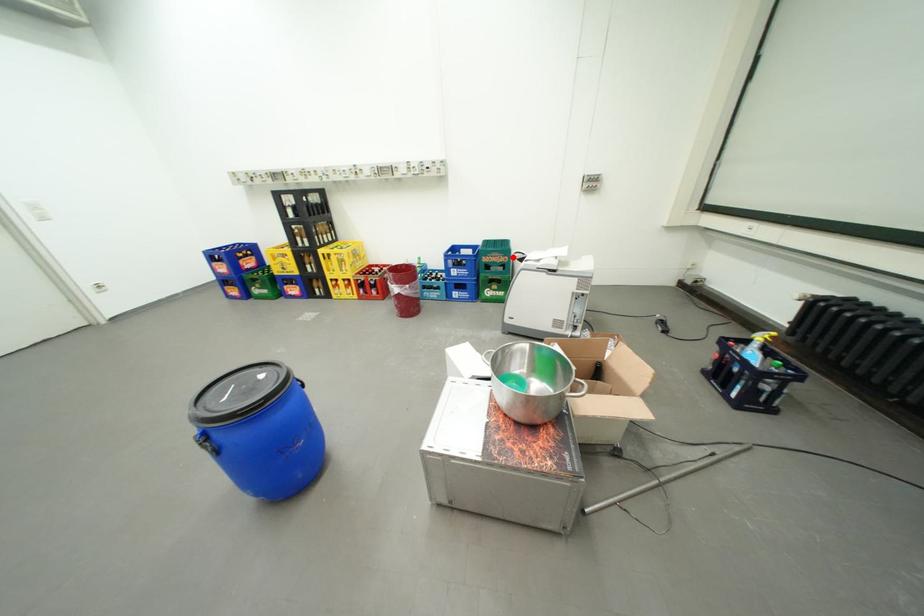
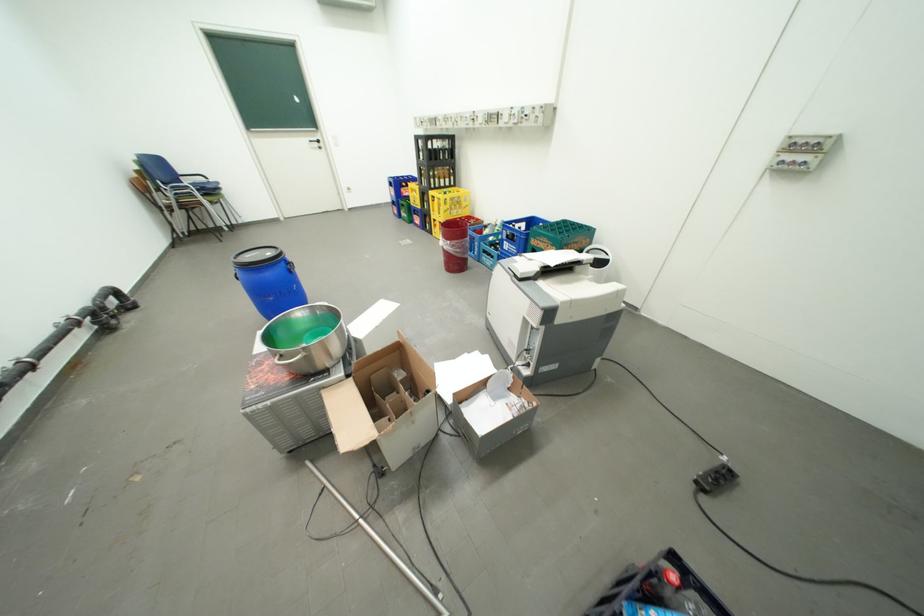
Where in the second image is the point corresponding to the highlighted location from the first image?

(562, 246)